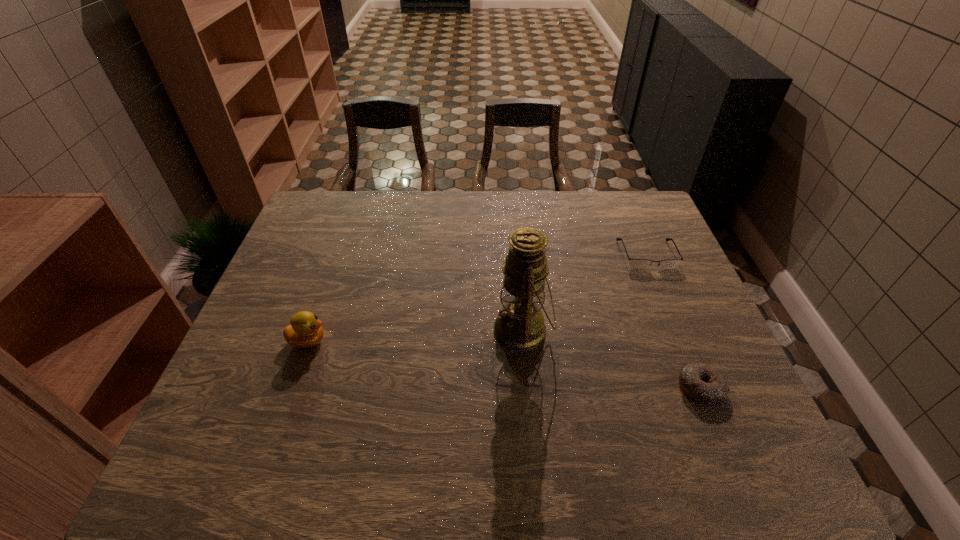
Locate an element on the screen. This screenshot has height=540, width=960. free space between the farthest object and the nearest object is located at coordinates (674, 321).

I want to click on vacant area that lies between the spectacles and the third object from right to left, so click(585, 293).

This screenshot has height=540, width=960. Find the location of `unoccupied position between the farthest object and the nearest object`. unoccupied position between the farthest object and the nearest object is located at coordinates (674, 321).

Locate an element on the screen. Image resolution: width=960 pixels, height=540 pixels. free space between the nearest object and the farthest object is located at coordinates (674, 321).

Where is `vacant region between the tallest object and the spectacles`? vacant region between the tallest object and the spectacles is located at coordinates (585, 293).

This screenshot has width=960, height=540. Identify the location of vacant region between the duckling and the nearest object. (504, 364).

Image resolution: width=960 pixels, height=540 pixels. Find the location of `free space between the spectacles and the oil lamp`. free space between the spectacles and the oil lamp is located at coordinates (585, 293).

The height and width of the screenshot is (540, 960). I want to click on vacant space in between the doughnut and the leftmost object, so click(x=504, y=364).

Find the location of a particular element. The image size is (960, 540). the third closest object to the duckling is located at coordinates (633, 263).

Identify the location of object that can be found as the closest to the leftmost object. Image resolution: width=960 pixels, height=540 pixels. [520, 326].